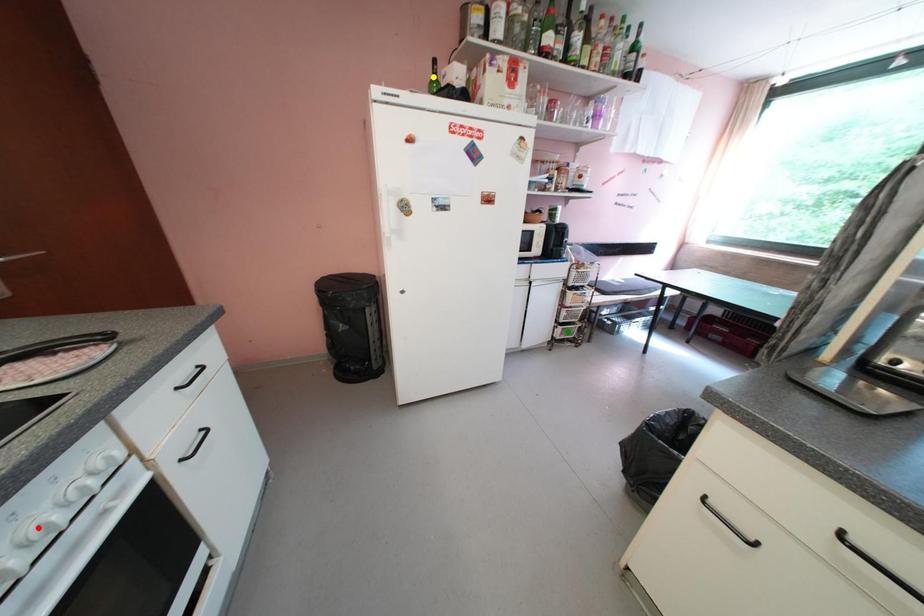
In the scene shown: Order these from farthest to nearest:
1. green point
2. yellow point
3. red point

1. green point
2. yellow point
3. red point